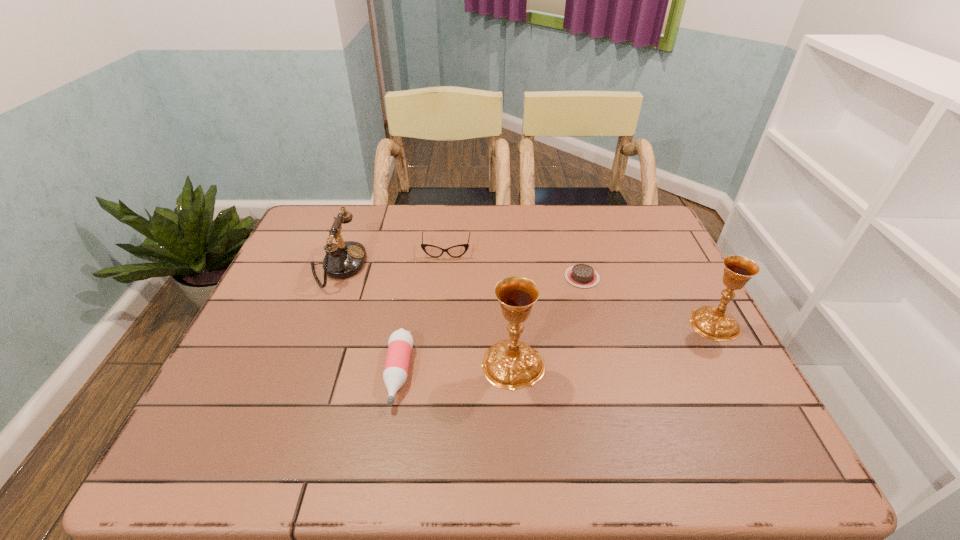
Identify the location of object that stands as the closest to the leftmost object. (456, 251).

Find the location of a particular element. blank area in the image that satisfies the following two spatial constraints: 1. on the front-facing side of the spectacles; 2. on the dial of the telephone is located at coordinates (444, 266).

You are a GUI agent. You are given a task and a screenshot of the screen. Output one action in this format:
    pyautogui.click(x=<x>, y=<y>)
    Task: Click on the free point that satisfies the following two spatial constraints: 1. on the dial of the leftmost object; 2. on the right side of the second object from right to left
    The height and width of the screenshot is (540, 960).
    Given the screenshot: What is the action you would take?
    pyautogui.click(x=333, y=277)

Find the location of a particular element. vacant space that satisfies the following two spatial constraints: 1. on the front-facing side of the spectacles; 2. on the left side of the shortest object is located at coordinates (444, 277).

This screenshot has width=960, height=540. Identify the location of vacant space that satisfies the following two spatial constraints: 1. on the dial of the taller chalice; 2. on the right side of the telephone. (300, 364).

You are a GUI agent. You are given a task and a screenshot of the screen. Output one action in this format:
    pyautogui.click(x=<x>, y=<y>)
    Task: Click on the vacant region that satisfies the following two spatial constraints: 1. on the dial of the right chalice; 2. on the left side of the telephone
    
    Given the screenshot: What is the action you would take?
    pyautogui.click(x=316, y=323)

This screenshot has height=540, width=960. In order to click on free space that satisfies the following two spatial constraints: 1. on the front-facing side of the spectacles; 2. on the dial of the third tallest object in this screenshot , I will do (x=444, y=266).

Find the location of a particular element. The image size is (960, 540). free space that satisfies the following two spatial constraints: 1. on the dial of the rightmost object; 2. on the right side of the leftmost object is located at coordinates (316, 323).